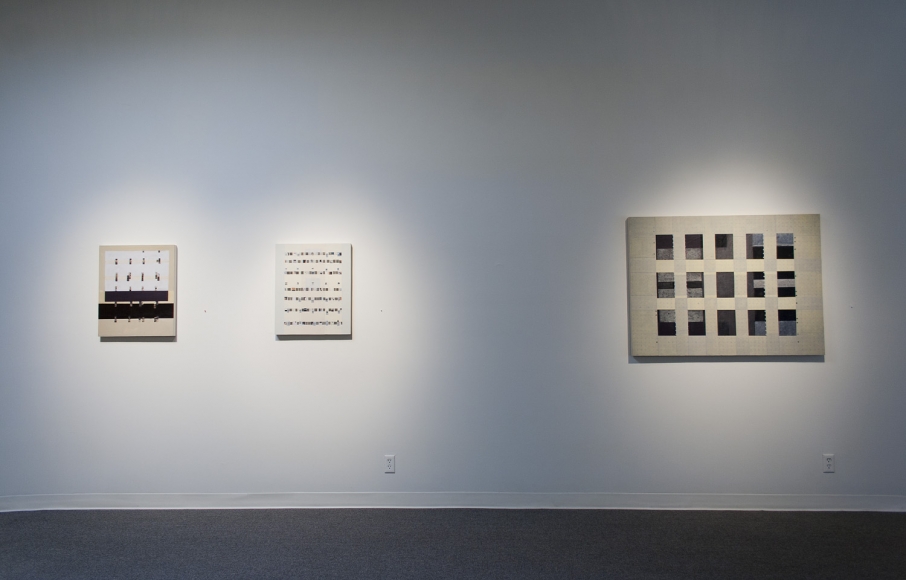
This screenshot has width=906, height=580. I want to click on wall, so click(x=496, y=246).